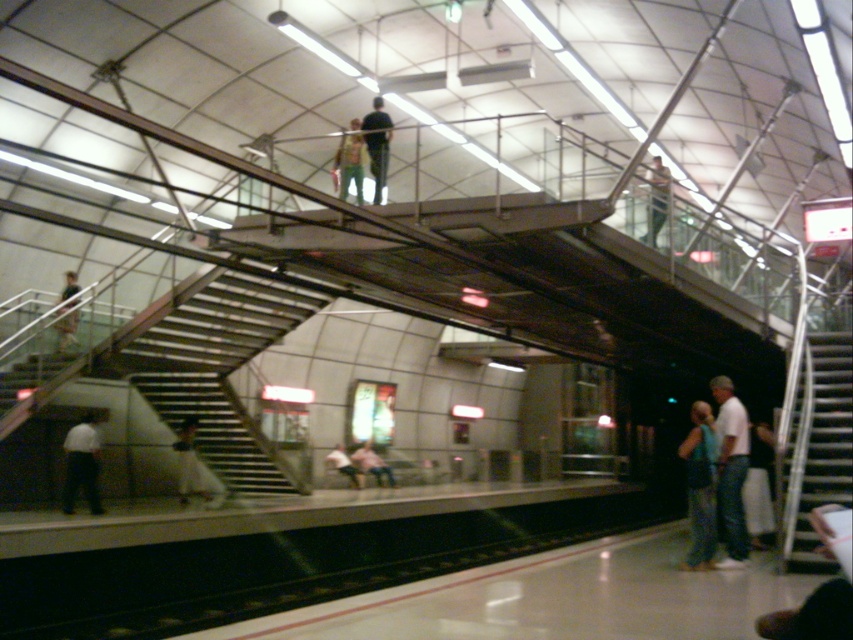
Is the position of white cotton shirt at lower right more distant than that of white satin dress at lower center?

That is False.

Can you confirm if white cotton shirt at lower right is positioned above white satin dress at lower center?

Correct, white cotton shirt at lower right is located above white satin dress at lower center.

The width and height of the screenshot is (853, 640). What are the coordinates of `white cotton shirt at lower right` in the screenshot? It's located at (730, 468).

What do you see at coordinates (376, 145) in the screenshot? This screenshot has height=640, width=853. I see `dark blue jeans at upper center` at bounding box center [376, 145].

Does dark blue jeans at upper center come in front of light pink fabric at lower center?

Yes, it is in front of light pink fabric at lower center.

Between point (376, 202) and point (326, 454), which one is positioned in front?

Point (376, 202) is in front.

Find the location of a particular element. The width and height of the screenshot is (853, 640). dark blue jeans at upper center is located at coordinates (376, 145).

From the picture: Which is more to the right, white shirt at lower left or light pink fabric at lower center?

Positioned to the right is light pink fabric at lower center.

Locate an element on the screen. white shirt at lower left is located at coordinates (82, 465).

Which is in front, point (90, 468) or point (337, 445)?

Point (90, 468)

Locate an element on the screen. white shirt at lower left is located at coordinates (82, 465).